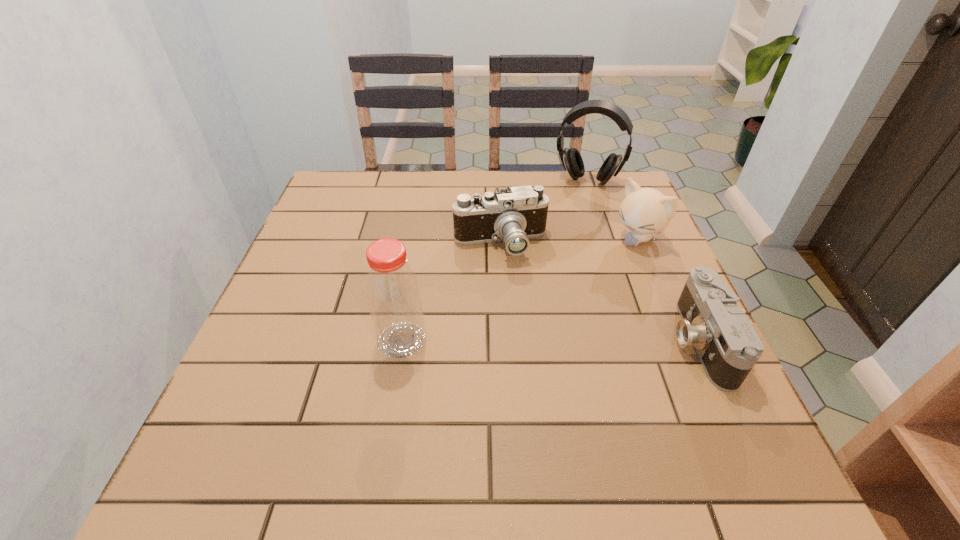
This screenshot has height=540, width=960. Identify the location of object that is at the far edge. (571, 159).

Locate an element on the screen. The width and height of the screenshot is (960, 540). object that is positioned at the near edge is located at coordinates (728, 346).

This screenshot has width=960, height=540. I want to click on camera situated at the right edge, so click(x=728, y=346).

Locate an element on the screen. This screenshot has width=960, height=540. kitten located at the right edge is located at coordinates (646, 212).

The image size is (960, 540). I want to click on earphone located in the right edge section of the desktop, so click(x=571, y=159).

I want to click on object that is at the far right corner, so click(x=571, y=159).

Where is `object located in the near right corner section of the desktop`? The image size is (960, 540). object located in the near right corner section of the desktop is located at coordinates (728, 346).

At what (x,y) coordinates should I click in order to perform the action: click on free space at the far edge. Please return your answer as a coordinate pair (x, y). Looking at the image, I should click on (418, 210).

This screenshot has width=960, height=540. In order to click on free space at the left edge in this screenshot , I will do `click(326, 230)`.

The image size is (960, 540). In the image, there is a desktop. In order to click on vacant space at the right edge in this screenshot , I will do `click(671, 342)`.